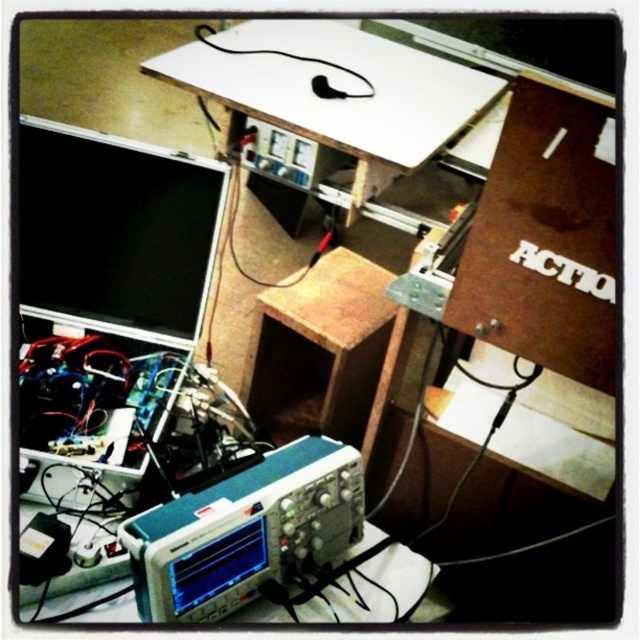
Who is taller, black matte computer monitor at upper left or blue metallic oscilloscope at center?

black matte computer monitor at upper left

Who is higher up, black matte computer monitor at upper left or blue metallic oscilloscope at center?

Positioned higher is black matte computer monitor at upper left.

This screenshot has height=640, width=640. What are the coordinates of `black matte computer monitor at upper left` in the screenshot? It's located at (115, 228).

Find the location of a particular element. This screenshot has height=640, width=640. black matte computer monitor at upper left is located at coordinates (115, 228).

Is black matte computer monitor at upper left shorter than black rubber wire at upper center?

Incorrect, black matte computer monitor at upper left's height does not fall short of black rubber wire at upper center's.

Who is more forward, (19, 250) or (252, 49)?

Point (19, 250) is more forward.

Find the location of a particular element. The width and height of the screenshot is (640, 640). black matte computer monitor at upper left is located at coordinates (115, 228).

The image size is (640, 640). Find the location of `white plastic table at upper center`. white plastic table at upper center is located at coordinates (336, 92).

Between white plastic table at upper center and blue metallic oscilloscope at center, which one is positioned higher?

white plastic table at upper center is above.

Who is more distant from viewer, (452, 129) or (236, 608)?

Positioned behind is point (452, 129).

Locate an element on the screen. This screenshot has height=640, width=640. white plastic table at upper center is located at coordinates (336, 92).